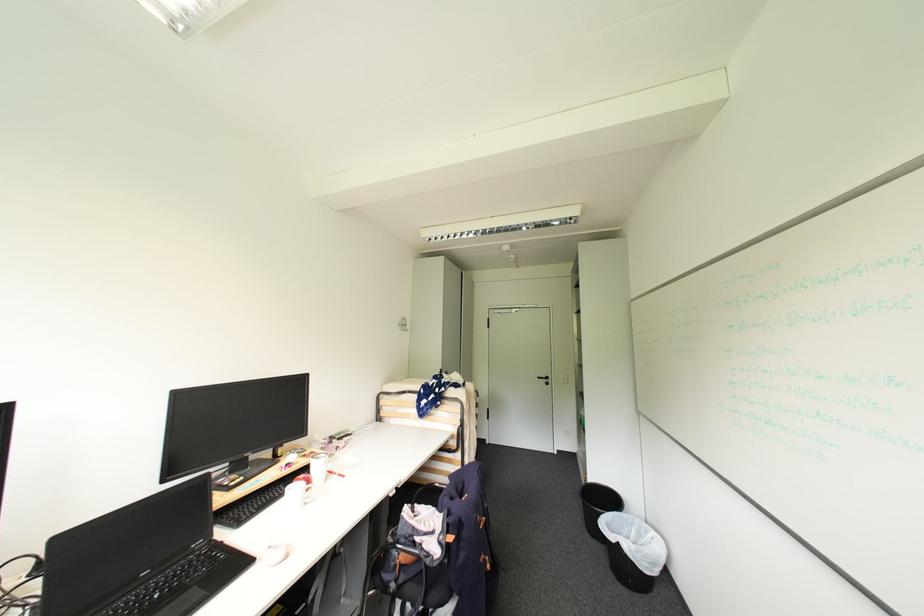
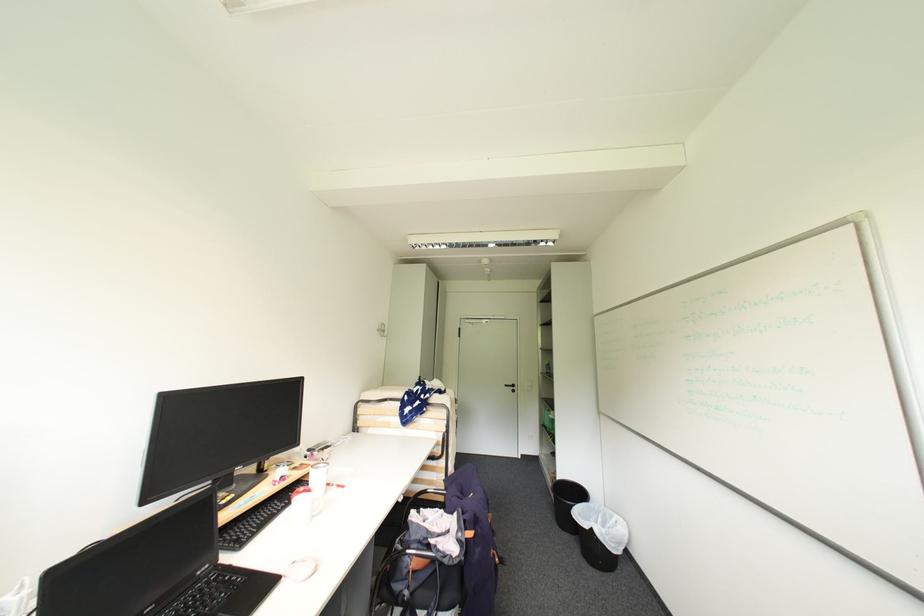
Question: I am providing you with two images of the same scene from different viewpoints. Please identify which objects are invisible in image2.

Choices:
 (A) metal wall hook
 (B) chair sitting surface
 (C) black trash can
 (D) none of these

Answer: (D)